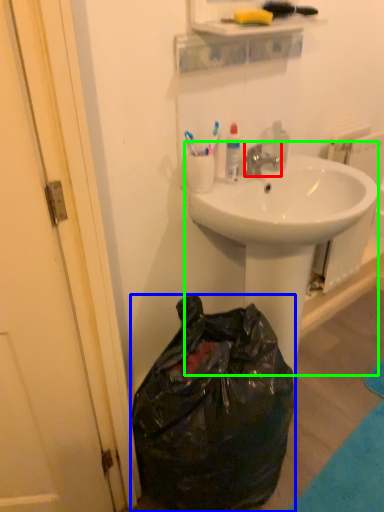
Question: Which is nearer to the faucet (highlighted by a red box)? trash bin/can (highlighted by a blue box) or sink (highlighted by a green box).

Choices:
 (A) trash bin/can
 (B) sink

Answer: (B)